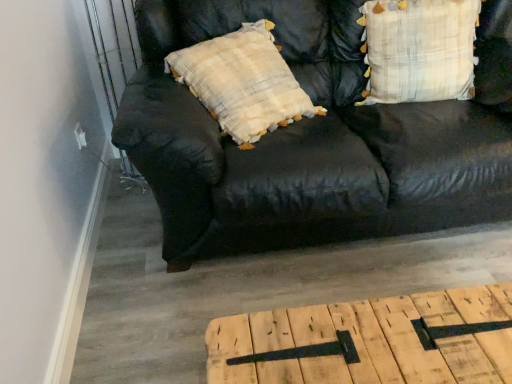
Question: From a real-world perspective, is plaid fabric pillow at upper right positioned under black leather couch at center based on gravity?

Choices:
 (A) no
 (B) yes

Answer: (A)

Question: Considering the relative positions of plaid fabric pillow at upper right and black leather couch at center in the image provided, is plaid fabric pillow at upper right in front of black leather couch at center?

Choices:
 (A) no
 (B) yes

Answer: (A)

Question: Is black leather couch at center inside plaid fabric pillow at upper right?

Choices:
 (A) yes
 (B) no

Answer: (B)

Question: Can you confirm if plaid fabric pillow at upper right is smaller than black leather couch at center?

Choices:
 (A) yes
 (B) no

Answer: (A)

Question: Is the surface of plaid fabric pillow at upper right in direct contact with black leather couch at center?

Choices:
 (A) no
 (B) yes

Answer: (A)

Question: Is plaid fabric pillow at upper right at the left side of black leather couch at center?

Choices:
 (A) no
 (B) yes

Answer: (A)

Question: Can you see black leather couch at center touching plaid fabric pillow at upper right?

Choices:
 (A) no
 (B) yes

Answer: (A)

Question: From a real-world perspective, is black leather couch at center beneath plaid fabric pillow at upper right?

Choices:
 (A) no
 (B) yes

Answer: (B)

Question: Can you confirm if black leather couch at center is positioned to the right of plaid fabric pillow at upper right?

Choices:
 (A) no
 (B) yes

Answer: (A)

Question: Is black leather couch at center smaller than plaid fabric pillow at upper right?

Choices:
 (A) yes
 (B) no

Answer: (B)

Question: Is black leather couch at center positioned in front of plaid fabric pillow at upper right?

Choices:
 (A) no
 (B) yes

Answer: (B)

Question: From a real-world perspective, is black leather couch at center on top of plaid fabric pillow at upper right?

Choices:
 (A) yes
 (B) no

Answer: (B)

Question: Can you confirm if light brown wood table at lower center is taller than black leather couch at center?

Choices:
 (A) yes
 (B) no

Answer: (B)